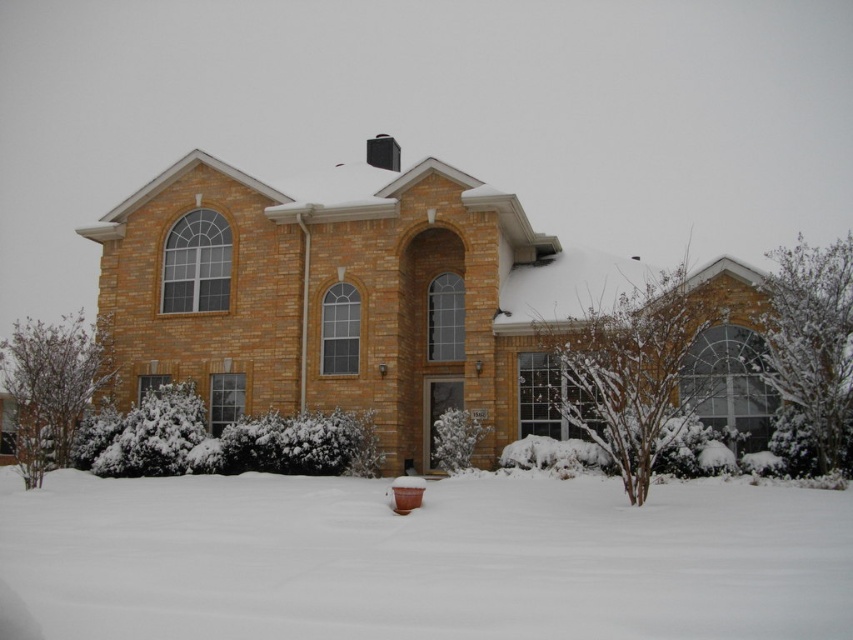
Question: Among these points, which one is nearest to the camera?

Choices:
 (A) (396, 378)
 (B) (384, 138)

Answer: (A)

Question: Estimate the real-world distances between objects in this image. Which object is farther from the brown brick house at center?

Choices:
 (A) white fluffy snow at lower center
 (B) black plastic chimney at upper center

Answer: (B)

Question: Is brown brick house at center thinner than black plastic chimney at upper center?

Choices:
 (A) no
 (B) yes

Answer: (A)

Question: Where is white fluffy snow at lower center located in relation to brown brick house at center in the image?

Choices:
 (A) right
 (B) left

Answer: (B)

Question: In this image, where is white fluffy snow at lower center located relative to brown brick house at center?

Choices:
 (A) right
 (B) left

Answer: (B)

Question: Which object is closer to the camera taking this photo?

Choices:
 (A) brown brick house at center
 (B) white fluffy snow at lower center
 (C) black plastic chimney at upper center

Answer: (B)